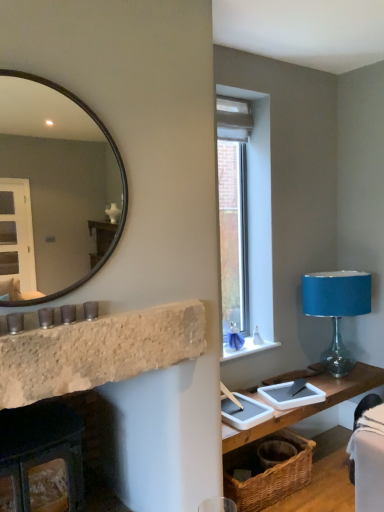
Question: From the image's perspective, is woven brown basket at lower right below woven wood table at lower right?

Choices:
 (A) yes
 (B) no

Answer: (B)

Question: Does woven brown basket at lower right contain woven wood table at lower right?

Choices:
 (A) yes
 (B) no

Answer: (B)

Question: From the image's perspective, does woven brown basket at lower right appear higher than woven wood table at lower right?

Choices:
 (A) yes
 (B) no

Answer: (A)

Question: Does woven brown basket at lower right have a lesser width compared to woven wood table at lower right?

Choices:
 (A) no
 (B) yes

Answer: (B)

Question: From a real-world perspective, is woven brown basket at lower right located higher than woven wood table at lower right?

Choices:
 (A) yes
 (B) no

Answer: (A)

Question: Visually, is rustic stone fireplace at left, which ranks as the first fireplace in top-to-bottom order, positioned to the left or to the right of clear glass window at upper right?

Choices:
 (A) right
 (B) left

Answer: (B)

Question: From the image's perspective, is rustic stone fireplace at left, the second fireplace when ordered from bottom to top, above or below clear glass window at upper right?

Choices:
 (A) below
 (B) above

Answer: (A)

Question: Relative to clear glass window at upper right, is rustic stone fireplace at left, the second fireplace when ordered from bottom to top, in front or behind?

Choices:
 (A) front
 (B) behind

Answer: (A)

Question: Is rustic stone fireplace at left, the second fireplace when ordered from bottom to top, inside the boundaries of clear glass window at upper right, or outside?

Choices:
 (A) inside
 (B) outside

Answer: (B)

Question: Considering the relative positions of clear glass window at upper right and velvet black swivel chair at lower right in the image provided, is clear glass window at upper right to the left or to the right of velvet black swivel chair at lower right?

Choices:
 (A) right
 (B) left

Answer: (B)

Question: Is clear glass window at upper right taller or shorter than velvet black swivel chair at lower right?

Choices:
 (A) short
 (B) tall

Answer: (B)

Question: Is clear glass window at upper right inside or outside of velvet black swivel chair at lower right?

Choices:
 (A) inside
 (B) outside

Answer: (B)

Question: Based on their sizes in the image, would you say clear glass window at upper right is bigger or smaller than velvet black swivel chair at lower right?

Choices:
 (A) big
 (B) small

Answer: (B)

Question: Based on their positions, is white stone window sill at center located to the left or right of rustic stone fireplace at left, which ranks as the first fireplace in top-to-bottom order?

Choices:
 (A) left
 (B) right

Answer: (B)

Question: Is white stone window sill at center bigger or smaller than rustic stone fireplace at left, which ranks as the first fireplace in top-to-bottom order?

Choices:
 (A) small
 (B) big

Answer: (A)